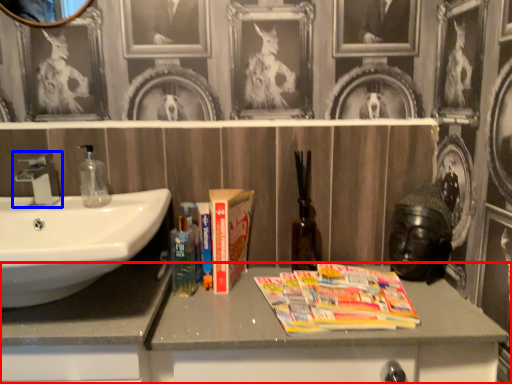
Question: Which of the following is the farthest to the observer, bathroom cabinet (highlighted by a red box) or tap (highlighted by a blue box)?

Choices:
 (A) bathroom cabinet
 (B) tap

Answer: (B)